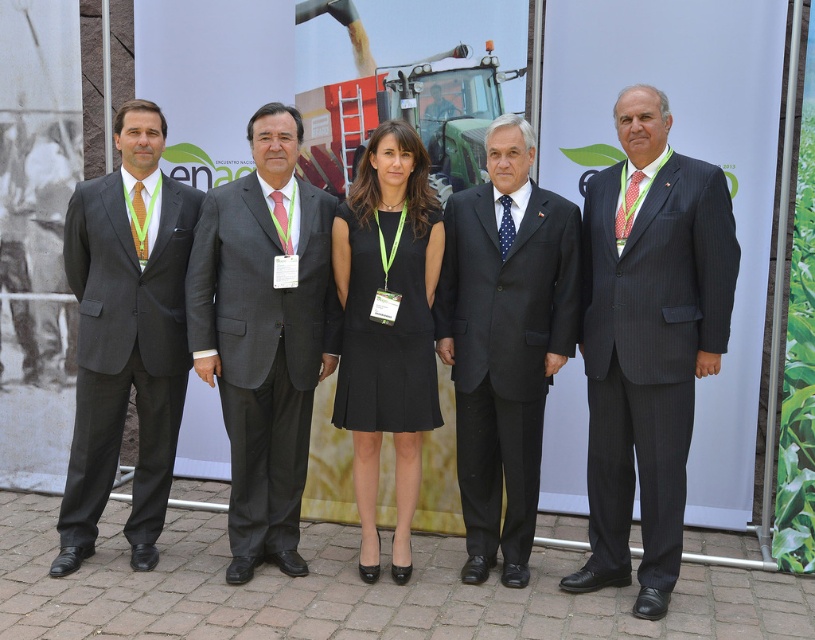
Does dark gray suit at center appear on the left side of black fabric dress at center?

Yes, dark gray suit at center is to the left of black fabric dress at center.

Where is `dark gray suit at center`? dark gray suit at center is located at coordinates (263, 333).

Can you confirm if dark pinstripe suit at right is wider than matte black suit at left?

Yes, dark pinstripe suit at right is wider than matte black suit at left.

Is dark pinstripe suit at right to the right of matte black suit at left from the viewer's perspective?

Correct, you'll find dark pinstripe suit at right to the right of matte black suit at left.

This screenshot has width=815, height=640. In order to click on dark pinstripe suit at right in this screenshot , I will do `click(648, 340)`.

Identify the location of dark pinstripe suit at right. (648, 340).

Measure the distance between dark gray suit at center and black pinstripe suit at center.

They are 82.77 centimeters apart.

Can you confirm if dark gray suit at center is positioned above black pinstripe suit at center?

Correct, dark gray suit at center is located above black pinstripe suit at center.

Find the location of `dark gray suit at center`. dark gray suit at center is located at coordinates (263, 333).